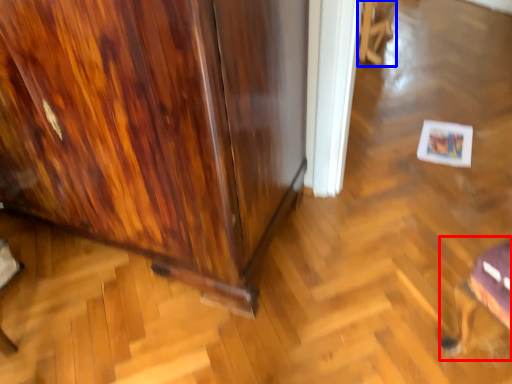
Question: Which of the following is the farthest to the observer, swivel chair (highlighted by a red box) or swivel chair (highlighted by a blue box)?

Choices:
 (A) swivel chair
 (B) swivel chair

Answer: (B)